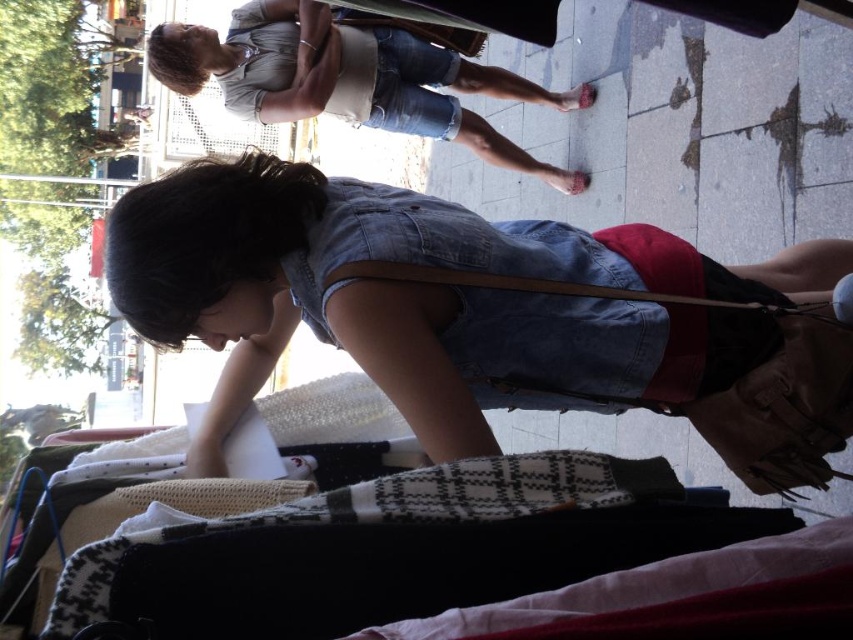
Question: Which of the following is the closest to the observer?

Choices:
 (A) (415, 125)
 (B) (694, 310)

Answer: (B)

Question: Which object is closer to the camera taking this photo?

Choices:
 (A) denim shorts at upper center
 (B) denim dress at center

Answer: (B)

Question: Does denim dress at center appear under denim shorts at upper center?

Choices:
 (A) no
 (B) yes

Answer: (B)

Question: Does denim dress at center have a lesser width compared to denim shorts at upper center?

Choices:
 (A) no
 (B) yes

Answer: (B)

Question: Can you confirm if denim dress at center is positioned to the left of denim shorts at upper center?

Choices:
 (A) yes
 (B) no

Answer: (B)

Question: Which of the following is the closest to the observer?

Choices:
 (A) (450, 332)
 (B) (482, 122)

Answer: (A)